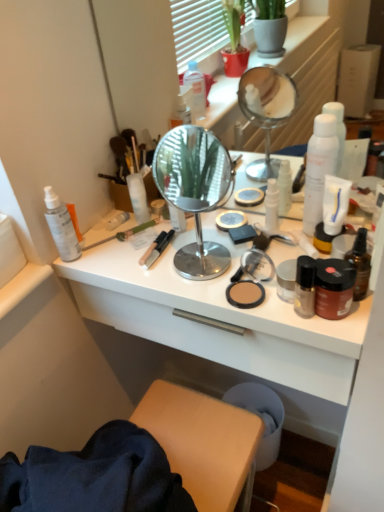
This screenshot has width=384, height=512. Find the location of `vacant space that is in between white matte bottle at center, the 5th toiletry viewed from the right, and white glossy bottle at center, the 5th toiletry viewed from the left`. vacant space that is in between white matte bottle at center, the 5th toiletry viewed from the right, and white glossy bottle at center, the 5th toiletry viewed from the left is located at coordinates (202, 223).